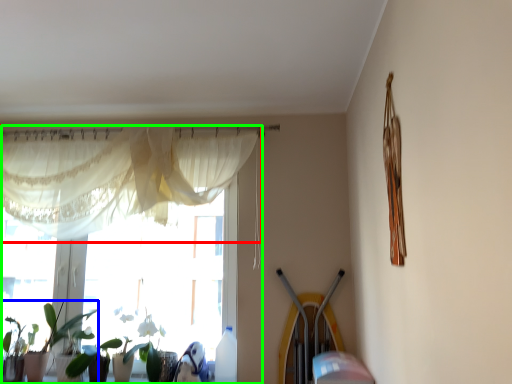
Question: Which is farther away from curtain (highlighted by a red box)? houseplant (highlighted by a blue box) or window (highlighted by a green box)?

Choices:
 (A) houseplant
 (B) window

Answer: (A)